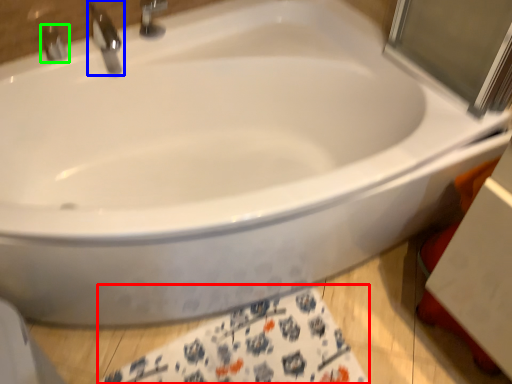
Question: Based on their relative distances, which object is farther from bath towel (highlighted by a red box)? Choose from tap (highlighted by a blue box) and tap (highlighted by a green box).

Choices:
 (A) tap
 (B) tap

Answer: (B)